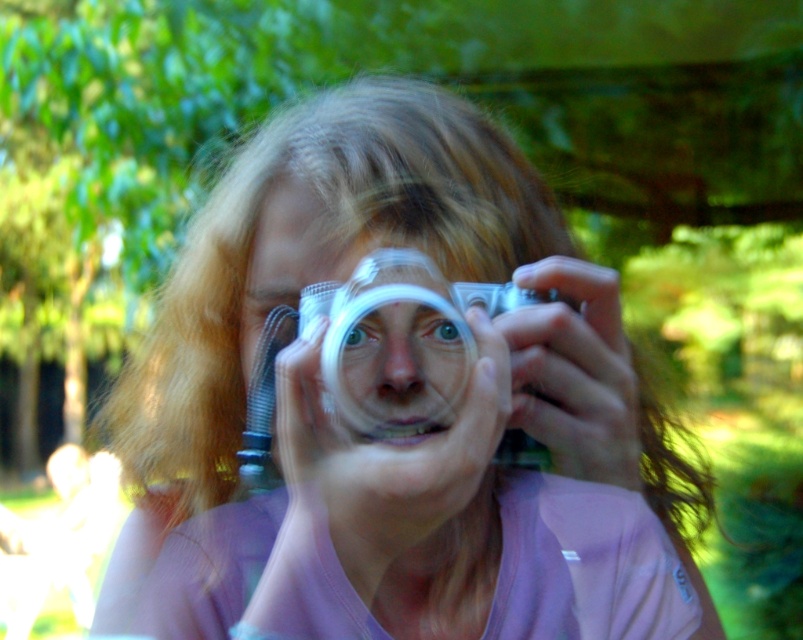
You are a photographer trying to capture a candid shot of the person in the image. You notice a specific point in the scene where the lighting is perfect for a natural glow. Which object in the scene is positioned exactly at the coordinates point (394, 349)?

The matte plastic face at center is positioned exactly at the coordinates point (394, 349).

You are a photographer trying to capture the perfect shot of the blue glossy eye at center and the green matte eye at center. Which eye should you focus on if you want to capture the larger one in your frame?

The green matte eye at center is larger than the blue glossy eye at center, so you should focus on the green matte eye at center to capture the larger one in your frame.

You are trying to take a photo of the person in the scene but notice two objects blocking your view. The matte plastic face at center and the blue glossy eye at center. Which object is closer to you, making it the primary obstruction?

The matte plastic face at center is closer to the viewer than the blue glossy eye at center, so it is the primary obstruction.